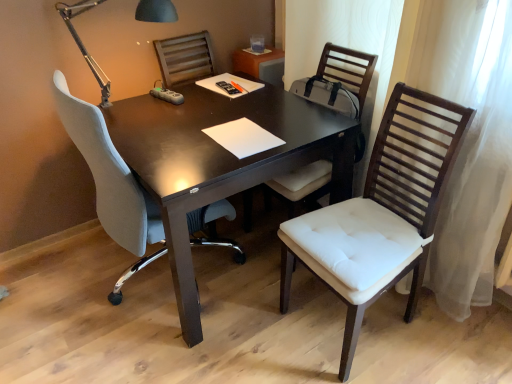
Locate an element on the screen. The width and height of the screenshot is (512, 384). vacant space that is in between dark wood table at center and white padded chair at right, the 3th chair from the left is located at coordinates (270, 344).